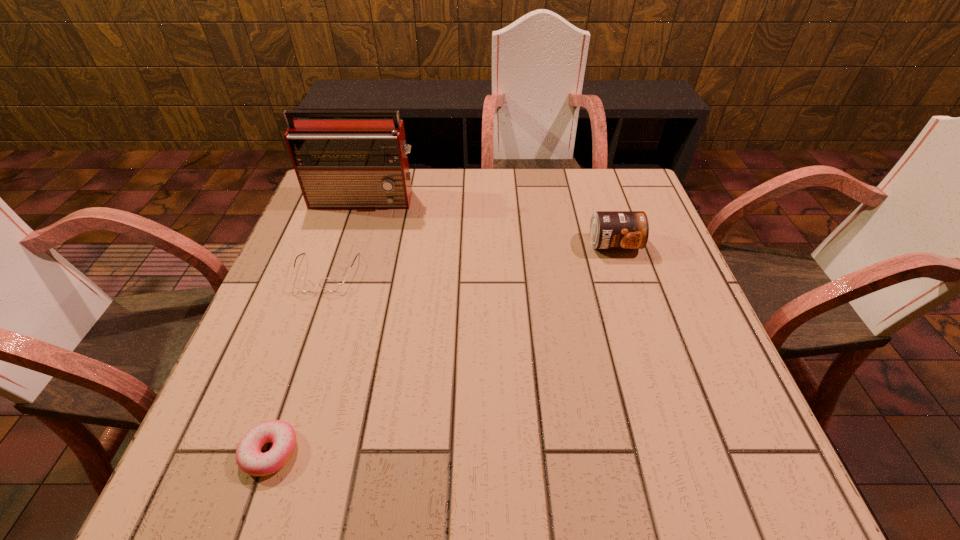
Locate an element on the screen. Image resolution: width=960 pixels, height=540 pixels. free space at the near edge of the desktop is located at coordinates (427, 438).

In order to click on vacant space at the left edge of the desktop in this screenshot , I will do point(267,308).

Where is `blank space at the right edge of the desktop`? blank space at the right edge of the desktop is located at coordinates (666, 330).

Identify the location of vacant space at the far right corner. (601, 208).

Find the location of a particular element. The image size is (960, 540). free space between the rightmost object and the shortest object is located at coordinates (442, 348).

The width and height of the screenshot is (960, 540). What are the coordinates of `free space between the can and the spectacles` in the screenshot? It's located at (469, 258).

Find the location of a particular element. vacant space in between the doughnut and the third tallest object is located at coordinates (298, 362).

Identify the location of empty location between the rightmost object and the doughnut. This screenshot has width=960, height=540. (442, 348).

You are a GUI agent. You are given a task and a screenshot of the screen. Output one action in this format:
    pyautogui.click(x=<x>, y=<y>)
    Task: Click on the vacant space that's between the tallest object and the third shortest object
    
    Given the screenshot: What is the action you would take?
    pyautogui.click(x=490, y=222)

Find the location of a particular element. The height and width of the screenshot is (540, 960). free spot between the tallest object and the third shortest object is located at coordinates (490, 222).